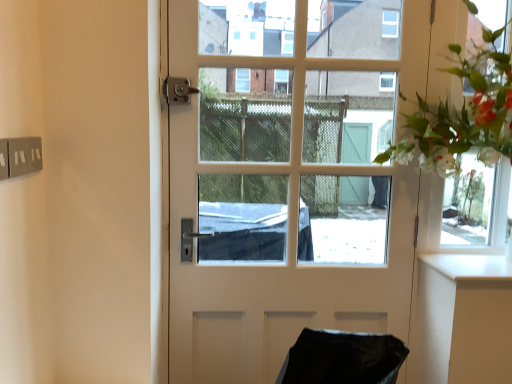
What do you see at coordinates (470, 266) in the screenshot? This screenshot has width=512, height=384. I see `white glossy counter top at right` at bounding box center [470, 266].

Image resolution: width=512 pixels, height=384 pixels. Describe the element at coordinates (270, 216) in the screenshot. I see `white glossy door at center` at that location.

Locate an element on the screen. This screenshot has width=512, height=384. white glossy counter top at right is located at coordinates (470, 266).

Which is behind, point (509, 98) or point (208, 7)?

Point (208, 7)

From a real-world perspective, between clear glass window frame at upper right and white glossy door at center, who is vertically higher?

clear glass window frame at upper right, from a real-world perspective.

Which is more to the right, clear glass window frame at upper right or white glossy door at center?

From the viewer's perspective, clear glass window frame at upper right appears more on the right side.

Is the position of clear glass window frame at upper right more distant than that of white glossy door at center?

Yes, clear glass window frame at upper right is further from the camera.

Locate an element on the screen. The width and height of the screenshot is (512, 384). window frame above the white glossy counter top at right (from a real-world perspective) is located at coordinates (476, 206).

From a real-world perspective, is clear glass window frame at upper right positioned above or below white glossy counter top at right?

clear glass window frame at upper right is above white glossy counter top at right.

Between clear glass window frame at upper right and white glossy counter top at right, which one has smaller size?

With smaller size is white glossy counter top at right.

Is point (494, 47) farther from camera compared to point (422, 256)?

No, (494, 47) is in front of (422, 256).

Do you think white glossy door at center is within clear glass window frame at upper right, or outside of it?

white glossy door at center is outside clear glass window frame at upper right.

This screenshot has width=512, height=384. In order to click on window frame behind the white glossy door at center in this screenshot , I will do `click(476, 206)`.

Is white glossy door at center far away from clear glass window frame at upper right?

white glossy door at center is actually quite close to clear glass window frame at upper right.

At what (x,y) coordinates should I click in order to perform the action: click on door above the white glossy counter top at right (from a real-world perspective). Please return your answer as a coordinate pair (x, y). This screenshot has height=384, width=512. Looking at the image, I should click on (270, 216).

From the image's perspective, which one is positioned higher, white glossy counter top at right or white glossy door at center?

white glossy door at center appears higher in the image.

Which is more to the right, white glossy counter top at right or white glossy door at center?

white glossy counter top at right.

From the picture: Is white glossy counter top at right facing away from clear glass window frame at upper right?

No, white glossy counter top at right is not facing away from clear glass window frame at upper right.

In the scene shown: Is white glossy counter top at right to the right of clear glass window frame at upper right from the viewer's perspective?

Incorrect, white glossy counter top at right is not on the right side of clear glass window frame at upper right.

From a real-world perspective, is white glossy counter top at right positioned above or below clear glass window frame at upper right?

white glossy counter top at right is below clear glass window frame at upper right.

From the picture: Which of these two, white glossy counter top at right or clear glass window frame at upper right, is thinner?

clear glass window frame at upper right.

Does point (240, 31) appear closer or farther from the camera than point (456, 275)?

Point (240, 31) appears to be farther away from the viewer than point (456, 275).

From their relative heights in the image, would you say white glossy door at center is taller or shorter than white glossy counter top at right?

In the image, white glossy door at center appears to be taller than white glossy counter top at right.

Is white glossy door at center facing away from white glossy counter top at right?

No.

Does white glossy door at center have a smaller size compared to white glossy counter top at right?

No, white glossy door at center is not smaller than white glossy counter top at right.

This screenshot has height=384, width=512. Identify the location of window frame behind the white glossy door at center. coord(476,206).

This screenshot has width=512, height=384. I want to click on counter top located below the clear glass window frame at upper right (from the image's perspective), so click(x=470, y=266).

Which object lies further to the anchor point white glossy door at center, clear glass window frame at upper right or white glossy counter top at right?

white glossy counter top at right is positioned further to the anchor white glossy door at center.

Which object lies nearer to the anchor point white glossy counter top at right, clear glass window frame at upper right or white glossy door at center?

Among the two, clear glass window frame at upper right is located nearer to white glossy counter top at right.

Based on their spatial positions, is white glossy door at center or clear glass window frame at upper right further from white glossy counter top at right?

The object further to white glossy counter top at right is white glossy door at center.

From the image, which object appears to be farther from white glossy door at center, white glossy counter top at right or clear glass window frame at upper right?

white glossy counter top at right.

From the image, which object appears to be nearer to clear glass window frame at upper right, white glossy counter top at right or white glossy door at center?

white glossy counter top at right lies closer to clear glass window frame at upper right than the other object.

Looking at this image, considering their positions, is white glossy door at center positioned further to clear glass window frame at upper right than white glossy counter top at right?

white glossy door at center is positioned further to the anchor clear glass window frame at upper right.

Find the location of a particular element. This screenshot has height=384, width=512. counter top situated between white glossy door at center and clear glass window frame at upper right from left to right is located at coordinates click(470, 266).